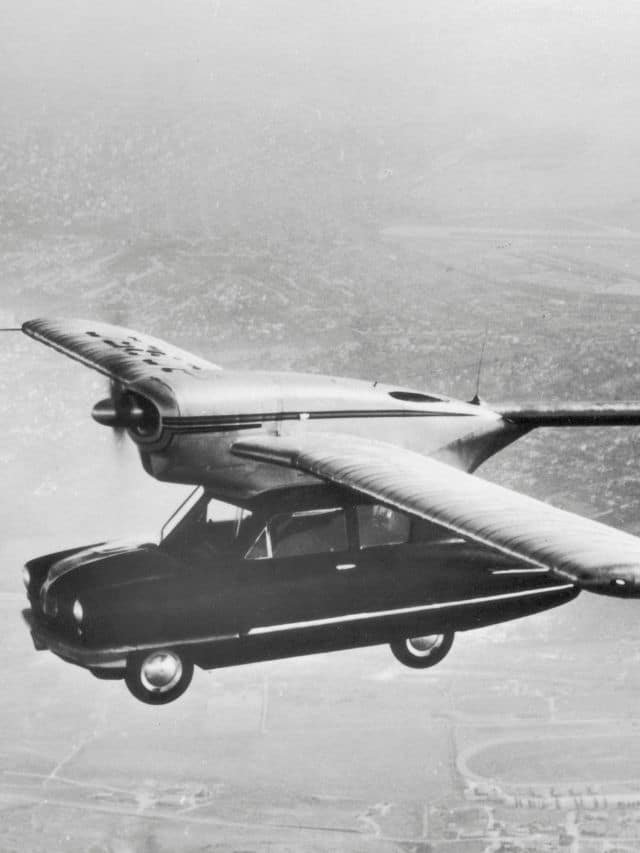
I want to click on hood, so click(x=130, y=566).